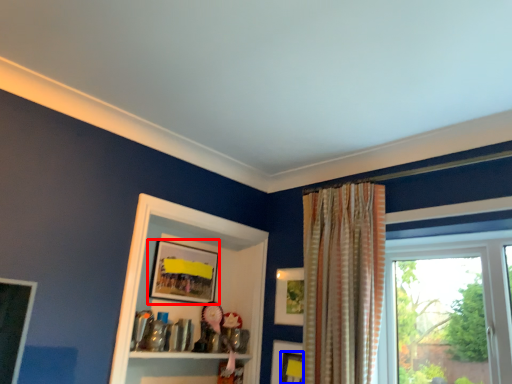
Question: Which of the following is the closest to the observer, picture frame (highlighted by a red box) or picture frame (highlighted by a blue box)?

Choices:
 (A) picture frame
 (B) picture frame

Answer: (B)